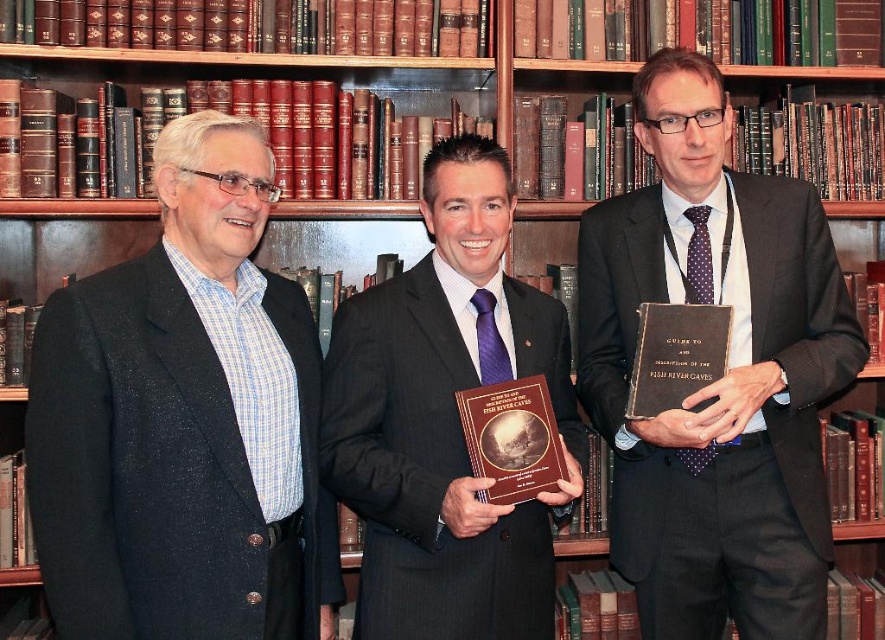
Is matte black suit at left bigger than matte black book at center?

No.

Between point (221, 272) and point (720, 260), which one is positioned in front?

Point (221, 272) is more forward.

Locate an element on the screen. matte black suit at left is located at coordinates (183, 420).

Does matte black suit at left have a smaller size compared to matte black suit at center?

No.

Does point (177, 451) lie in front of point (462, 168)?

Yes, point (177, 451) is in front of point (462, 168).

The height and width of the screenshot is (640, 885). What do you see at coordinates (183, 420) in the screenshot? I see `matte black suit at left` at bounding box center [183, 420].

Identify the location of matte black suit at left. The width and height of the screenshot is (885, 640). (183, 420).

Does matte black book at center come in front of matte black suit at center?

No, matte black book at center is further to the viewer.

Which is behind, point (759, 493) or point (418, 556)?

Point (759, 493)

This screenshot has height=640, width=885. I want to click on matte black book at center, so click(720, 378).